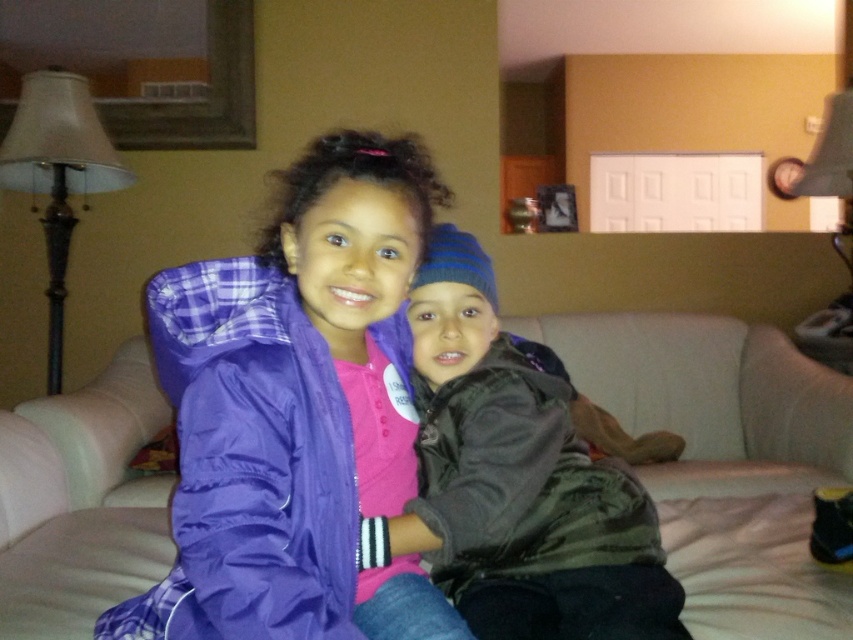
You are a photographer setting up for a family photo. You need to position a light source to the right of the purple matte jacket at center and to the left of the dark gray fleece jacket at center. Is this possible based on their current positions?

The purple matte jacket at center is to the left of the dark gray fleece jacket at center, so placing a light source to the right of the purple matte jacket at center and to the left of the dark gray fleece jacket at center is possible as the light can be positioned between them.

You are a delivery person who needs to place a large package on the beige fabric couch at center where the children are sitting. Considering the size of the couch and the black matte jacket at center, will there be enough space for the package?

The beige fabric couch at center has a larger size compared to the black matte jacket at center, so there should be enough space to place the large package on the couch.

You are an interior designer analyzing the layout of this living room. You need to place a new lamp that will be 0.5 meters away from the purple matte jacket at center. What coordinate should the lamp be placed at?

The lamp should be placed at a coordinate that is 0.5 meters away from the purple matte jacket at center, which is located at point (292, 410). However, without knowing the scale of the coordinate system, it is impossible to determine the exact placement. Please provide more information about the coordinate system scale.